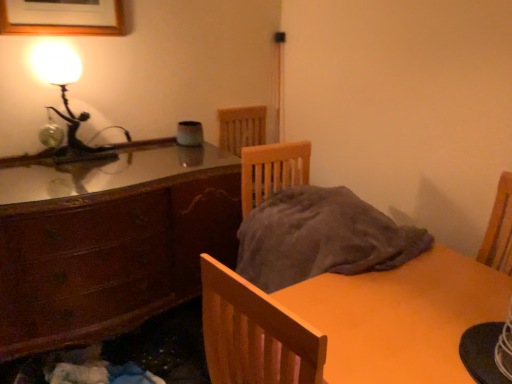
Question: Is the depth of wooden cabinet at left greater than that of matte wooden table at lower right?

Choices:
 (A) no
 (B) yes

Answer: (B)

Question: From a real-world perspective, is wooden cabinet at left below matte wooden table at lower right?

Choices:
 (A) yes
 (B) no

Answer: (B)

Question: Does wooden cabinet at left have a lesser height compared to matte wooden table at lower right?

Choices:
 (A) yes
 (B) no

Answer: (B)

Question: Is wooden cabinet at left outside matte wooden table at lower right?

Choices:
 (A) no
 (B) yes

Answer: (B)

Question: From the image's perspective, does wooden cabinet at left appear lower than matte wooden table at lower right?

Choices:
 (A) no
 (B) yes

Answer: (A)

Question: Does wooden cabinet at left have a lesser width compared to matte wooden table at lower right?

Choices:
 (A) yes
 (B) no

Answer: (A)

Question: Is wooden picture frame at upper left outside of wooden cabinet at left?

Choices:
 (A) yes
 (B) no

Answer: (A)

Question: Is wooden picture frame at upper left positioned far away from wooden cabinet at left?

Choices:
 (A) yes
 (B) no

Answer: (B)

Question: Does wooden picture frame at upper left touch wooden cabinet at left?

Choices:
 (A) yes
 (B) no

Answer: (B)

Question: Is wooden picture frame at upper left wider than wooden cabinet at left?

Choices:
 (A) yes
 (B) no

Answer: (B)

Question: Is wooden picture frame at upper left at the right side of wooden cabinet at left?

Choices:
 (A) yes
 (B) no

Answer: (B)

Question: Is wooden picture frame at upper left looking in the opposite direction of wooden cabinet at left?

Choices:
 (A) no
 (B) yes

Answer: (A)

Question: Considering the relative positions of wooden cabinet at left and matte glass lamp at upper left in the image provided, is wooden cabinet at left behind matte glass lamp at upper left?

Choices:
 (A) yes
 (B) no

Answer: (B)